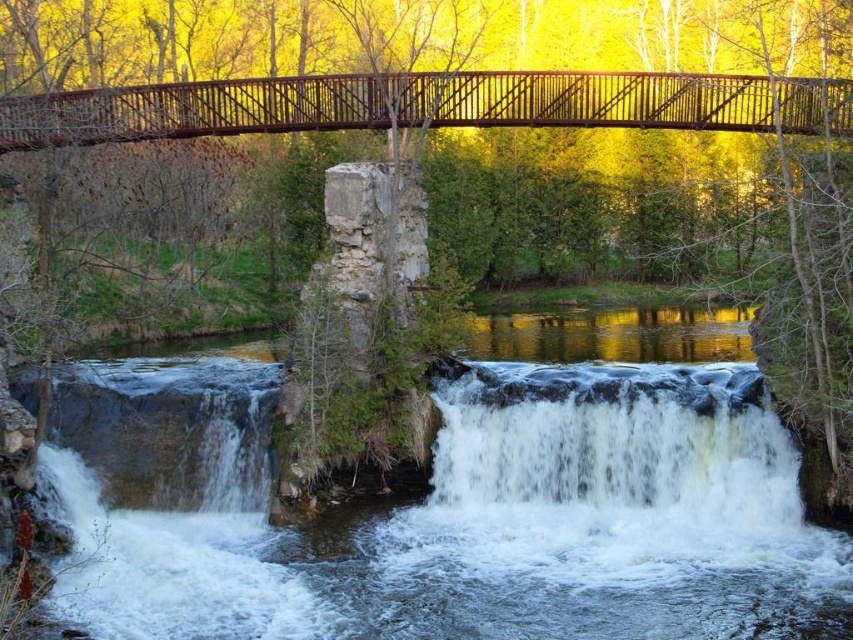
You are standing on the metal bridge and looking down at the water. Which object, the smooth stone waterfall at center or the white frothy water at center, is closer to you?

The smooth stone waterfall at center is closer to you because it is positioned in front of the white frothy water at center.

You are standing at the point marked by coordinates point (459, 499) in the image. What object is exactly at that location?

The smooth stone waterfall at center is located at point (459, 499).

You are standing at the edge of the river and want to cross to the other side. The smooth stone waterfall at center is in your way. Can you walk around it to reach the opposite bank?

The smooth stone waterfall at center is 128.47 feet away from you, so you can walk around it to reach the opposite bank since the distance allows for a detour.